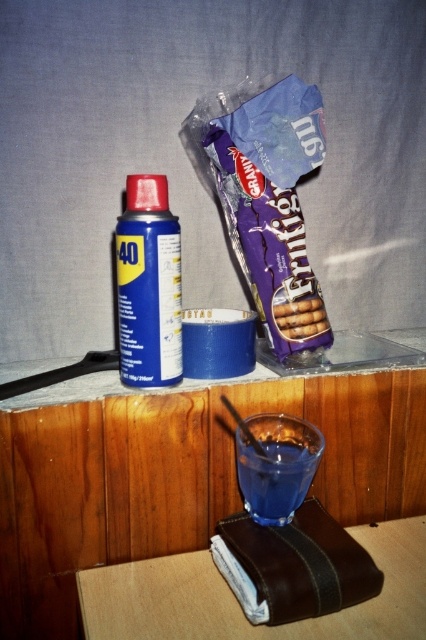
Is matte purple chocolate bar at center below brown crumbly cookies at center?

Yes.

Is matte purple chocolate bar at center positioned in front of brown crumbly cookies at center?

Yes, it is.

Which is in front, point (301, 602) or point (281, 320)?

Point (301, 602) is more forward.

Identify the location of matte purple chocolate bar at center. (301, 563).

From the picture: Does transparent glass at lower center have a smaller size compared to brown crumbly cookies at center?

Actually, transparent glass at lower center might be larger than brown crumbly cookies at center.

Is transparent glass at lower center positioned at the back of brown crumbly cookies at center?

No, transparent glass at lower center is closer to the viewer.

Which is in front, point (284, 468) or point (287, 323)?

Point (284, 468)

Find the location of `transparent glass at lower center`. transparent glass at lower center is located at coordinates (275, 477).

Which is behind, point (126, 282) or point (321, 308)?

The point (321, 308) is more distant.

Can you confirm if blue matte spray can at center is thinner than brown crumbly cookies at center?

No.

Does point (120, 273) lie in front of point (279, 310)?

Yes, it is.

Identify the location of blue matte spray can at center. 149,285.